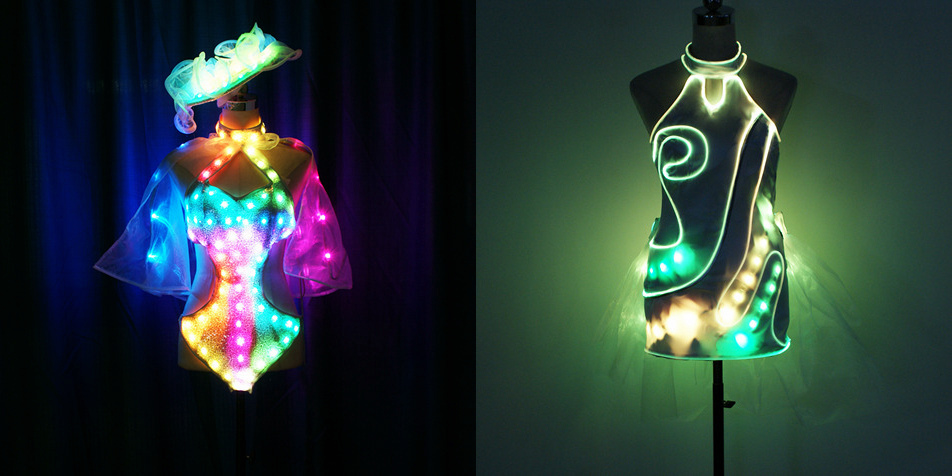
Image resolution: width=952 pixels, height=476 pixels. In order to click on stand in this screenshot , I will do `click(712, 414)`.